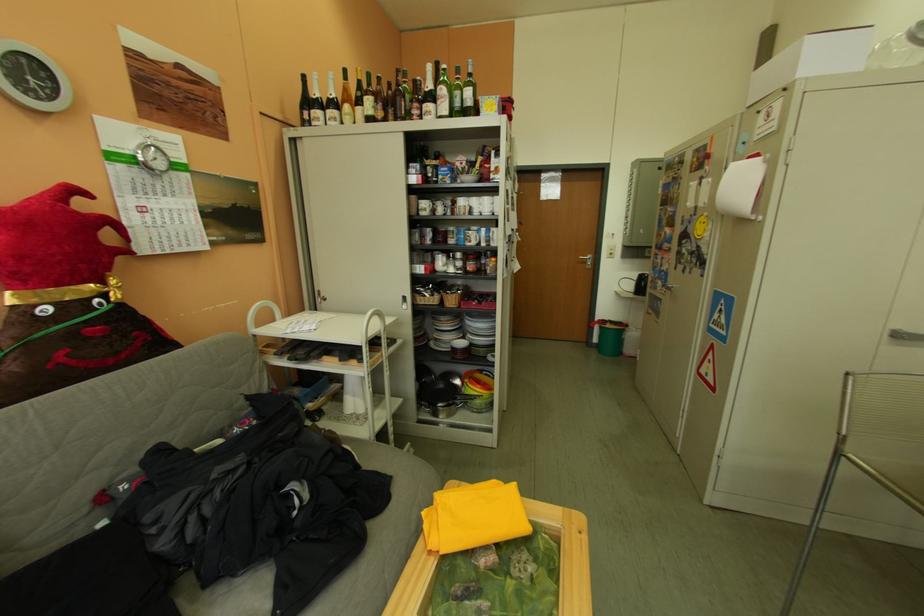
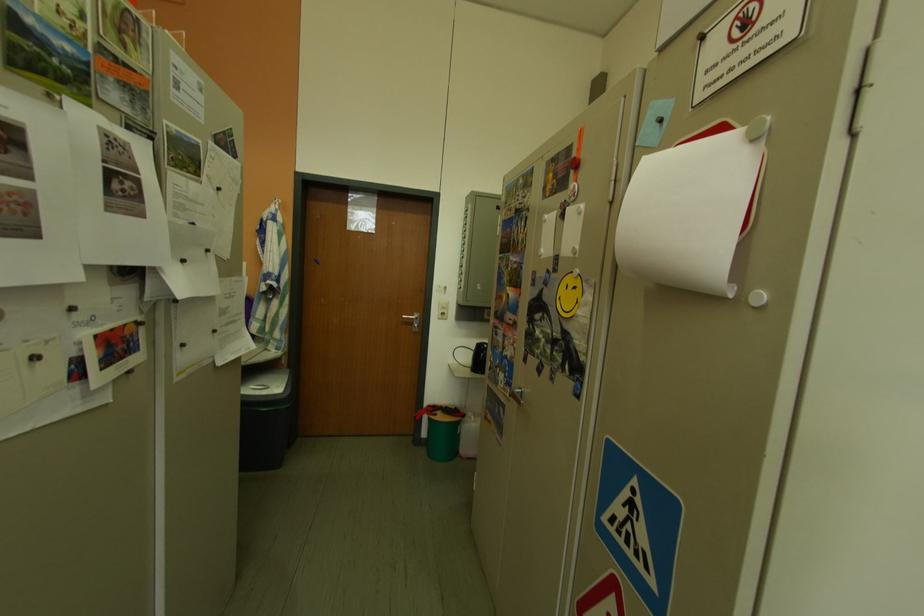
The images are taken continuously from a first-person perspective. In which direction are you moving?

The cameraman moved toward right, forward.